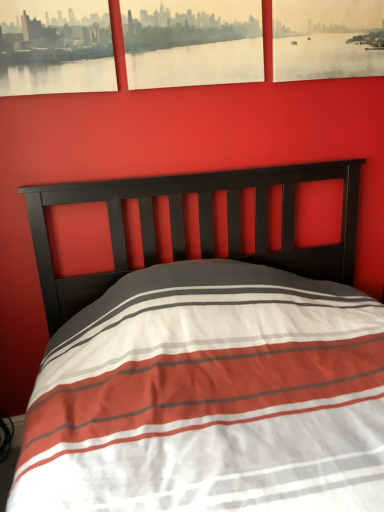
Question: Which direction should I rotate to look at matte paper picture frame at upper center, acting as the second picture frame starting from the left?

Choices:
 (A) left
 (B) right

Answer: (A)

Question: From a real-world perspective, is matte paper picture frame at upper right, which is the 3th picture frame in left-to-right order, on top of matte paper picture frame at upper center, acting as the second picture frame starting from the left?

Choices:
 (A) yes
 (B) no

Answer: (B)

Question: From the image's perspective, does matte paper picture frame at upper right, which ranks as the first picture frame in right-to-left order, appear higher than matte paper picture frame at upper center, acting as the second picture frame starting from the right?

Choices:
 (A) yes
 (B) no

Answer: (A)

Question: From the image's perspective, is matte paper picture frame at upper right, which ranks as the first picture frame in right-to-left order, located beneath matte paper picture frame at upper center, acting as the second picture frame starting from the right?

Choices:
 (A) yes
 (B) no

Answer: (B)

Question: Considering the relative positions of matte paper picture frame at upper right, which ranks as the first picture frame in right-to-left order, and matte paper picture frame at upper center, acting as the second picture frame starting from the right, in the image provided, is matte paper picture frame at upper right, which ranks as the first picture frame in right-to-left order, to the left of matte paper picture frame at upper center, acting as the second picture frame starting from the right, from the viewer's perspective?

Choices:
 (A) yes
 (B) no

Answer: (B)

Question: Does matte paper picture frame at upper right, which ranks as the first picture frame in right-to-left order, have a larger size compared to matte paper picture frame at upper center, acting as the second picture frame starting from the right?

Choices:
 (A) yes
 (B) no

Answer: (B)

Question: Does matte paper picture frame at upper right, which ranks as the first picture frame in right-to-left order, touch matte paper picture frame at upper center, acting as the second picture frame starting from the left?

Choices:
 (A) yes
 (B) no

Answer: (B)

Question: Does matte paper picture frame at upper right, which ranks as the first picture frame in right-to-left order, turn towards matte black picture frame at upper left, the third picture frame in the right-to-left sequence?

Choices:
 (A) yes
 (B) no

Answer: (B)

Question: Would you say matte paper picture frame at upper right, which ranks as the first picture frame in right-to-left order, is a long distance from matte black picture frame at upper left, arranged as the first picture frame when viewed from the left?

Choices:
 (A) yes
 (B) no

Answer: (B)

Question: Is matte paper picture frame at upper right, which ranks as the first picture frame in right-to-left order, smaller than matte black picture frame at upper left, the third picture frame in the right-to-left sequence?

Choices:
 (A) yes
 (B) no

Answer: (B)

Question: Does matte paper picture frame at upper right, which ranks as the first picture frame in right-to-left order, have a greater width compared to matte black picture frame at upper left, arranged as the first picture frame when viewed from the left?

Choices:
 (A) yes
 (B) no

Answer: (B)

Question: Does matte paper picture frame at upper right, which is the 3th picture frame in left-to-right order, have a greater height compared to matte black picture frame at upper left, arranged as the first picture frame when viewed from the left?

Choices:
 (A) no
 (B) yes

Answer: (B)

Question: From a real-world perspective, is matte paper picture frame at upper right, which is the 3th picture frame in left-to-right order, below matte black picture frame at upper left, the third picture frame in the right-to-left sequence?

Choices:
 (A) no
 (B) yes

Answer: (B)

Question: Can you confirm if matte paper picture frame at upper center, acting as the second picture frame starting from the left, is positioned to the right of matte black picture frame at upper left, the third picture frame in the right-to-left sequence?

Choices:
 (A) yes
 (B) no

Answer: (A)